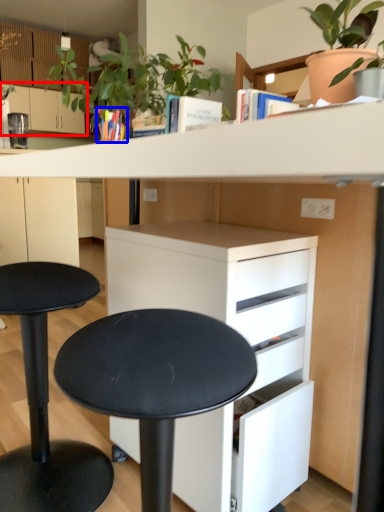
Question: Which point is closer to the camera, cabinetry (highlighted by a red box) or book (highlighted by a blue box)?

Choices:
 (A) cabinetry
 (B) book

Answer: (B)